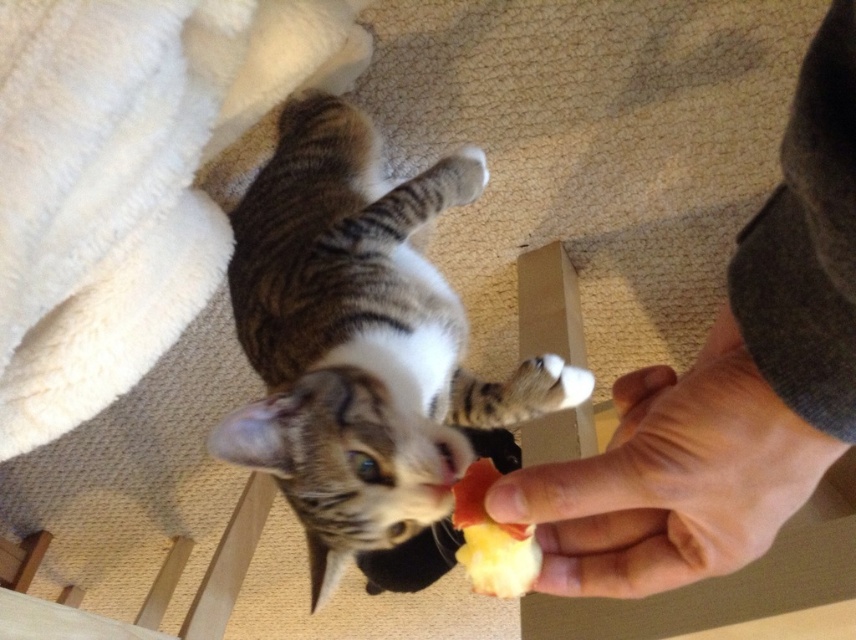
Question: Which point appears closest to the camera in this image?

Choices:
 (A) (421, 486)
 (B) (531, 550)
 (C) (728, 339)
 (D) (770, 499)

Answer: (D)

Question: Which point is closer to the camera?

Choices:
 (A) gray fabric hand at lower right
 (B) smooth skin hand at lower right
 (C) yellowish matte apple slice at center

Answer: (A)

Question: Is tabby fur cat at center bigger than smooth skin hand at lower right?

Choices:
 (A) yes
 (B) no

Answer: (A)

Question: Does gray fabric hand at lower right appear on the right side of smooth skin hand at lower right?

Choices:
 (A) no
 (B) yes

Answer: (B)

Question: Which is nearer to the gray fabric hand at lower right?

Choices:
 (A) yellowish matte apple slice at center
 (B) tabby fur cat at center

Answer: (A)

Question: Is smooth skin hand at lower right below yellowish matte apple slice at center?

Choices:
 (A) yes
 (B) no

Answer: (B)